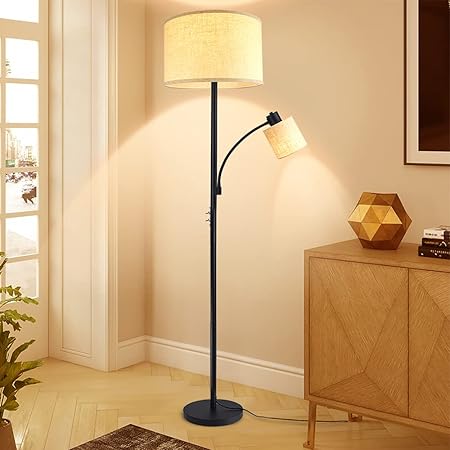
Where is `decoration`? This screenshot has height=450, width=450. decoration is located at coordinates (375, 221).